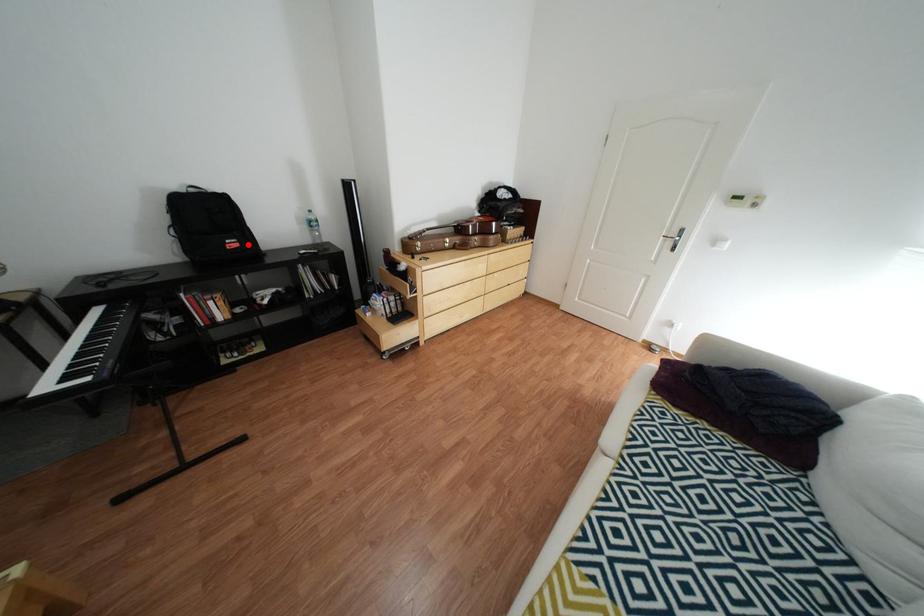
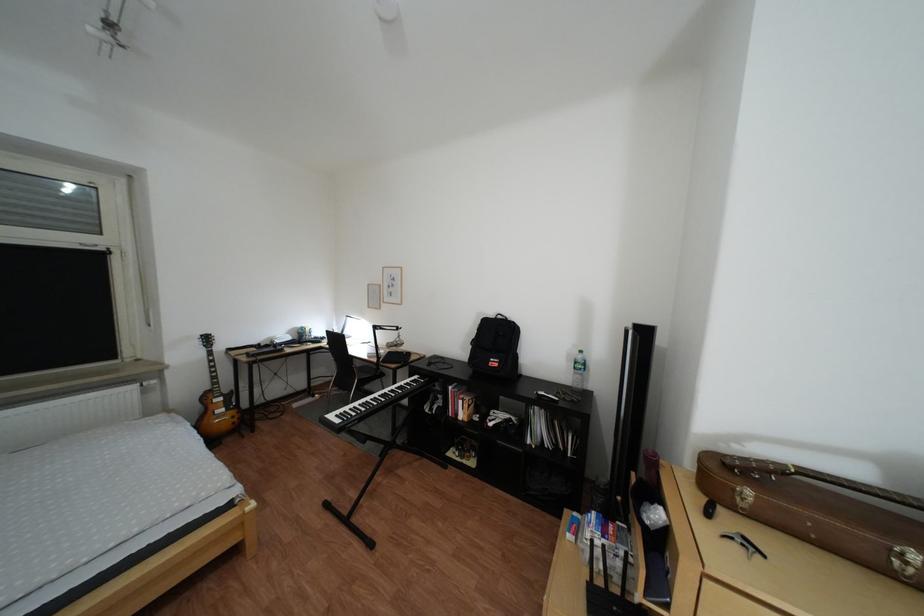
Question: I am providing you with two images of the same scene from different viewpoints. In image1, a red point is highlighted. Considering the same 3D point in image2, which of the following is correct?

Choices:
 (A) It is closer
 (B) It is farther

Answer: (B)